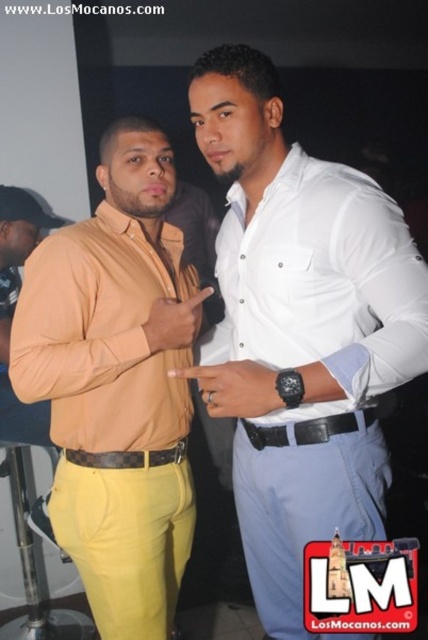
Which is in front, point (264, 540) or point (287, 353)?

Positioned in front is point (287, 353).

Can you confirm if white smooth shirt at center is positioned to the left of white cotton shirt at right?

Yes, white smooth shirt at center is to the left of white cotton shirt at right.

You are a GUI agent. You are given a task and a screenshot of the screen. Output one action in this format:
    pyautogui.click(x=<x>, y=<y>)
    Task: Click on the white smooth shirt at center
    The height and width of the screenshot is (640, 428).
    Given the screenshot: What is the action you would take?
    pyautogui.click(x=300, y=328)

Does matte yellow pants at left have a greater height compared to black leather belt at center?

Indeed, matte yellow pants at left has a greater height compared to black leather belt at center.

Which is in front, point (35, 269) or point (324, 420)?

Point (324, 420)

Where is `matte yellow pants at left`? The image size is (428, 640). matte yellow pants at left is located at coordinates (116, 381).

Which is more to the right, white cotton shirt at right or brown leather belt at center?

white cotton shirt at right is more to the right.

Consider the image. Does white cotton shirt at right appear over brown leather belt at center?

Yes.

Where is `white cotton shirt at right`? The width and height of the screenshot is (428, 640). white cotton shirt at right is located at coordinates (321, 284).

At what (x,y) coordinates should I click in order to perform the action: click on white cotton shirt at right. Please return your answer as a coordinate pair (x, y). Looking at the image, I should click on (321, 284).